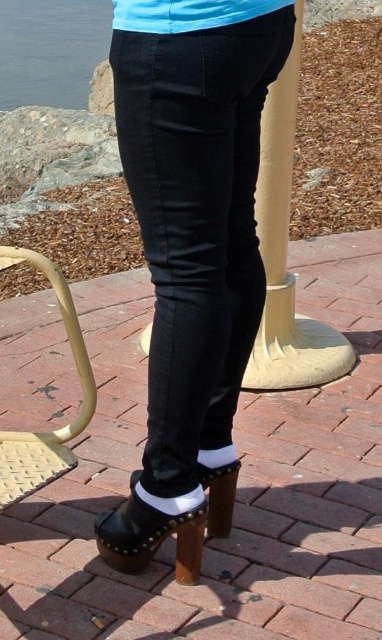
You are standing on the walkway and want to place a small potted plant between the black leather clogs at lower center and the beige woven stool at lower left. Can you do this without moving either object?

The black leather clogs at lower center is above the beige woven stool at lower left, so there is no space between them on the walkway to place a small potted plant without moving either object.

You are trying to decide whether to place the beige woven stool at lower left next to the black leather clogs at lower center. Given their sizes, will the stool fit comfortably next to the clogs without overcrowding the space?

The black leather clogs at lower center are bigger than the beige woven stool at lower left. Since the clogs are larger, there should be enough space to place the beige woven stool at lower left next to them without overcrowding the area.